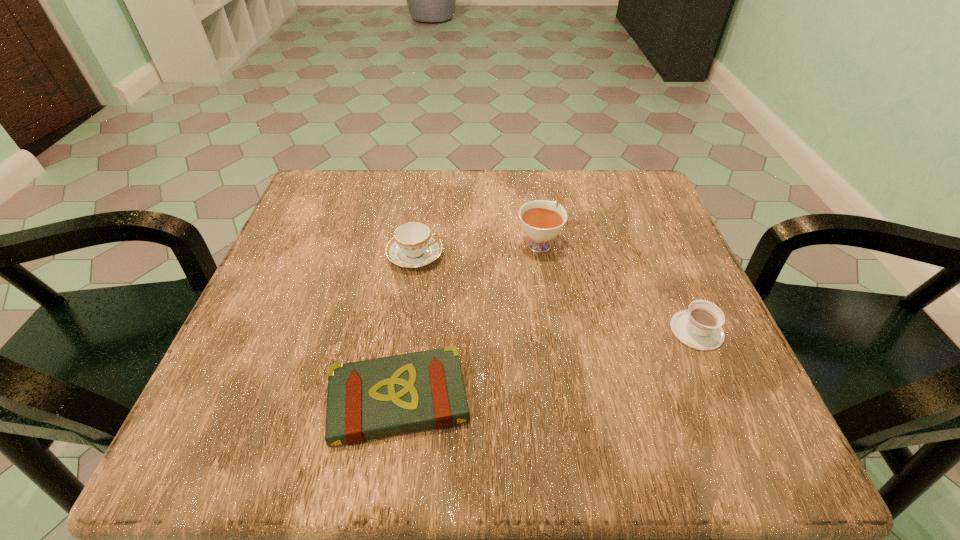
Find the location of a particular element. the tallest object is located at coordinates (541, 221).

Locate an element on the screen. Image resolution: width=960 pixels, height=540 pixels. the second object from right to left is located at coordinates pos(541,221).

Where is `the second shortest teacup`? The height and width of the screenshot is (540, 960). the second shortest teacup is located at coordinates (413, 245).

Locate an element on the screen. Image resolution: width=960 pixels, height=540 pixels. the second tallest object is located at coordinates [413, 245].

Where is `the shortest teacup`? Image resolution: width=960 pixels, height=540 pixels. the shortest teacup is located at coordinates (699, 327).

The height and width of the screenshot is (540, 960). I want to click on the rightmost object, so click(x=699, y=327).

Identify the location of the nearest object. (370, 399).

Find the location of a particular element. book is located at coordinates (370, 399).

Find the location of a particular element. Image resolution: width=960 pixels, height=540 pixels. blank area located on the side of the third object from left to right with the handle is located at coordinates click(535, 213).

Image resolution: width=960 pixels, height=540 pixels. I want to click on free location located on the side of the third object from left to right with the handle, so click(x=532, y=193).